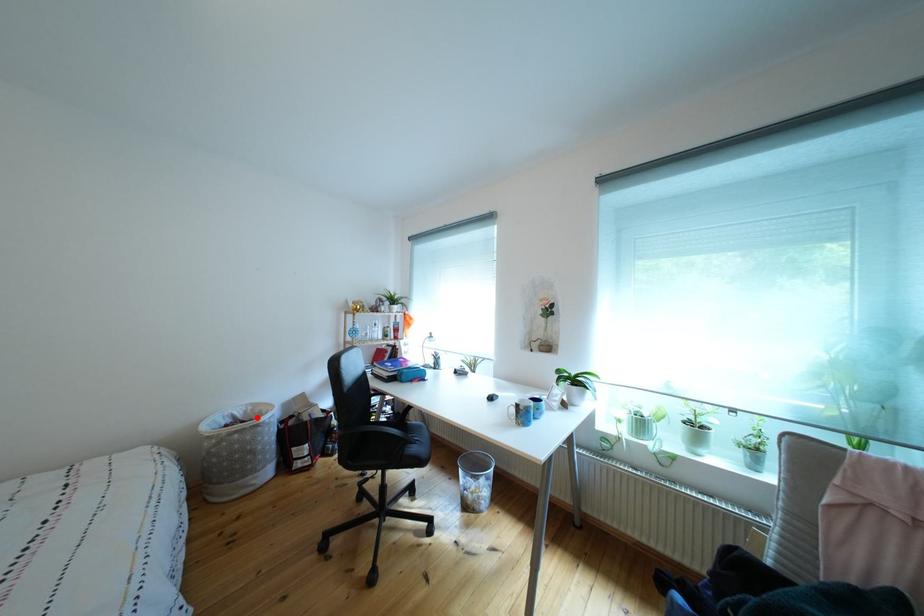
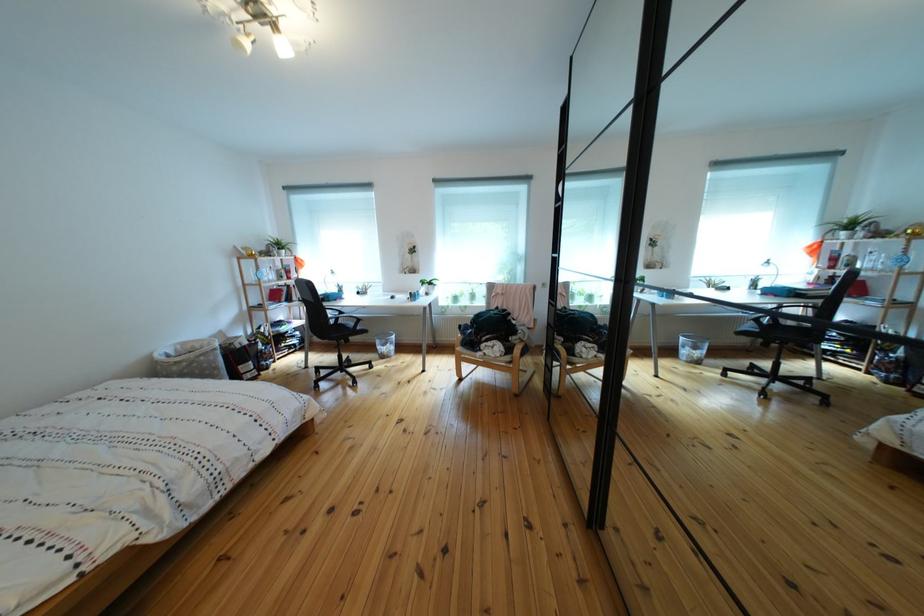
Question: I am providing you with two images of the same scene from different viewpoints. A red point is marked on the first image. Can you still see the location of the red point in image 2?

Choices:
 (A) Yes
 (B) No

Answer: (A)